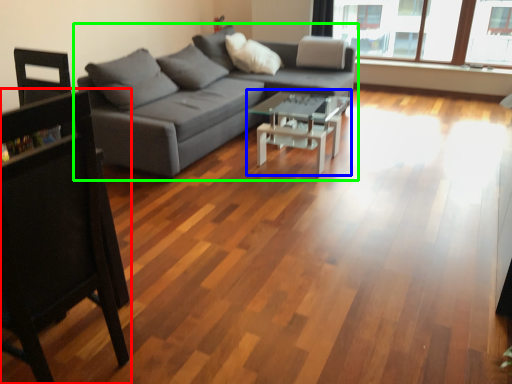
Question: Considering the real-world distances, which object is closest to chair (highlighted by a red box)? coffee table (highlighted by a blue box) or studio couch (highlighted by a green box).

Choices:
 (A) coffee table
 (B) studio couch

Answer: (B)